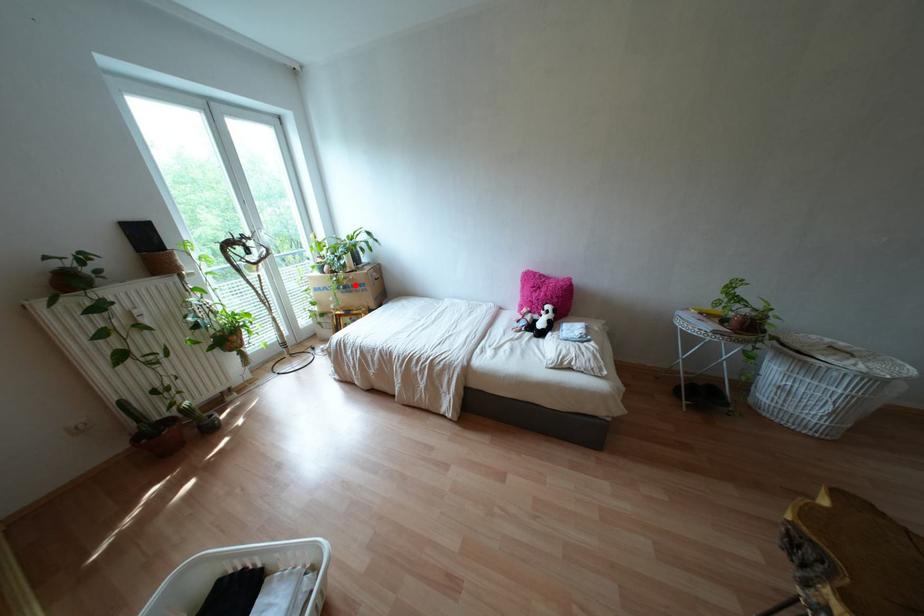
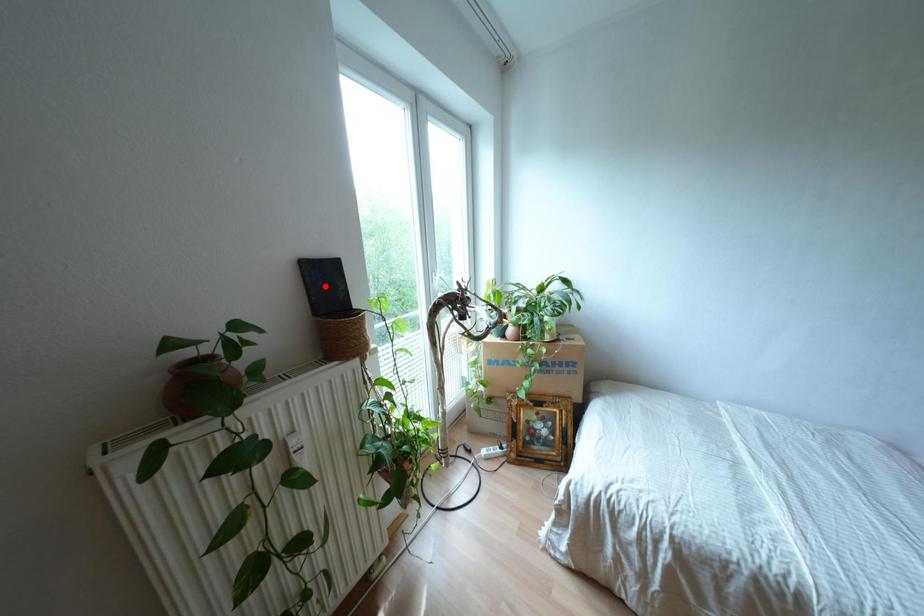
I am providing you with two images of the same scene from different viewpoints. A red point is marked on the first image and another point is marked on the second image. Is the marked point in image1 the same physical position as the marked point in image2?

No